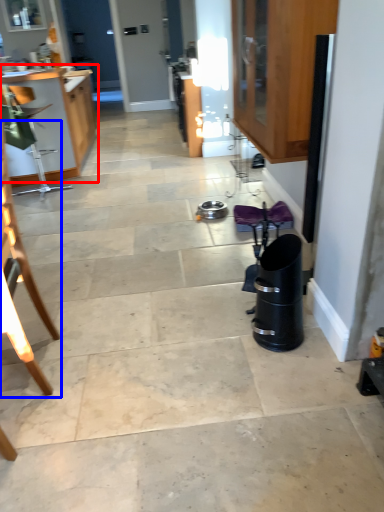
Question: Which object is further to the camera taking this photo, cabinetry (highlighted by a red box) or chair (highlighted by a blue box)?

Choices:
 (A) cabinetry
 (B) chair

Answer: (A)